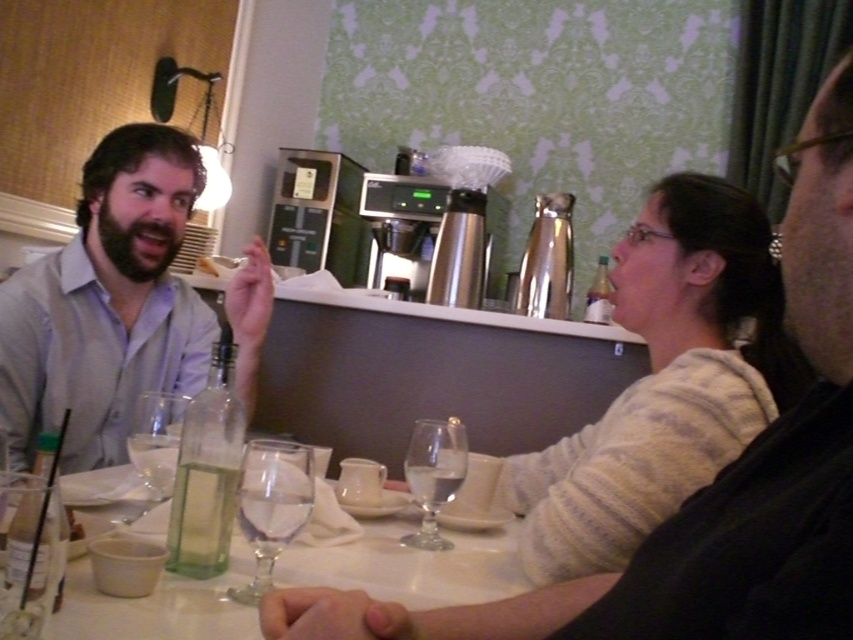
Question: Which point appears farthest from the camera in this image?

Choices:
 (A) (6, 314)
 (B) (787, 256)
 (C) (248, 614)

Answer: (A)

Question: Does clear glass wine at center have a larger size compared to transparent glass wine glass at lower center?

Choices:
 (A) no
 (B) yes

Answer: (B)

Question: Is matte white shirt at left below transparent glass wine glass at lower center?

Choices:
 (A) yes
 (B) no

Answer: (B)

Question: Which of the following is the farthest from the observer?

Choices:
 (A) clear glass wine at center
 (B) light gray sweater at center

Answer: (B)

Question: Which point appears farthest from the camera in this image?

Choices:
 (A) (149, 404)
 (B) (450, 445)
 (C) (804, 481)
 (D) (192, 141)

Answer: (D)

Question: Does clear glass wine at center appear over transparent glass wine glass at lower center?

Choices:
 (A) no
 (B) yes

Answer: (B)